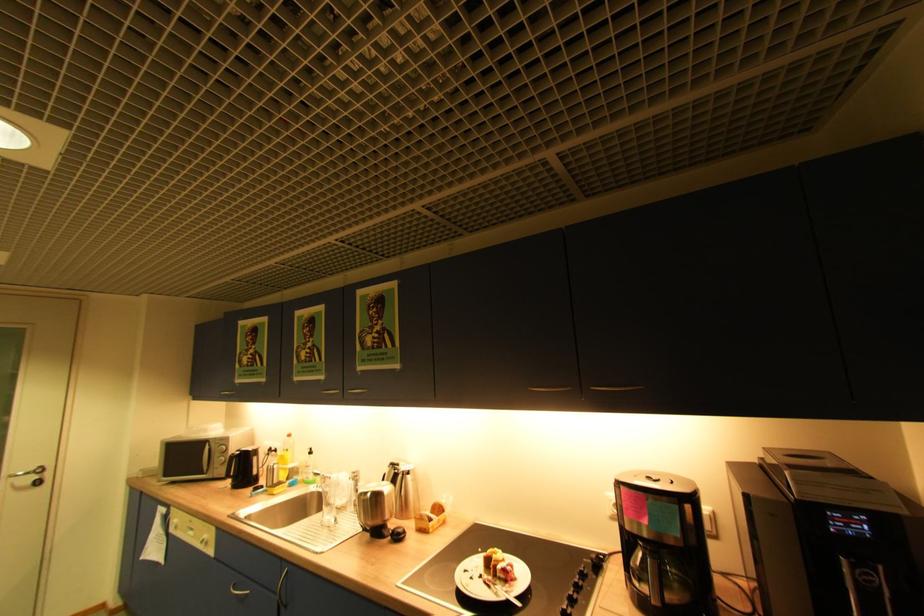
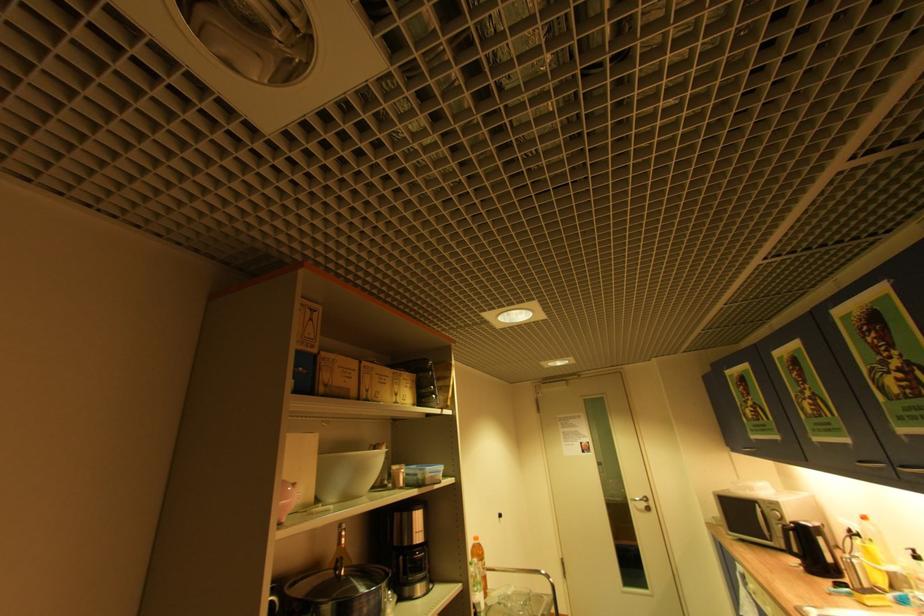
Find the pixel in the second image that matches (331,392) in the first image.

(867, 463)